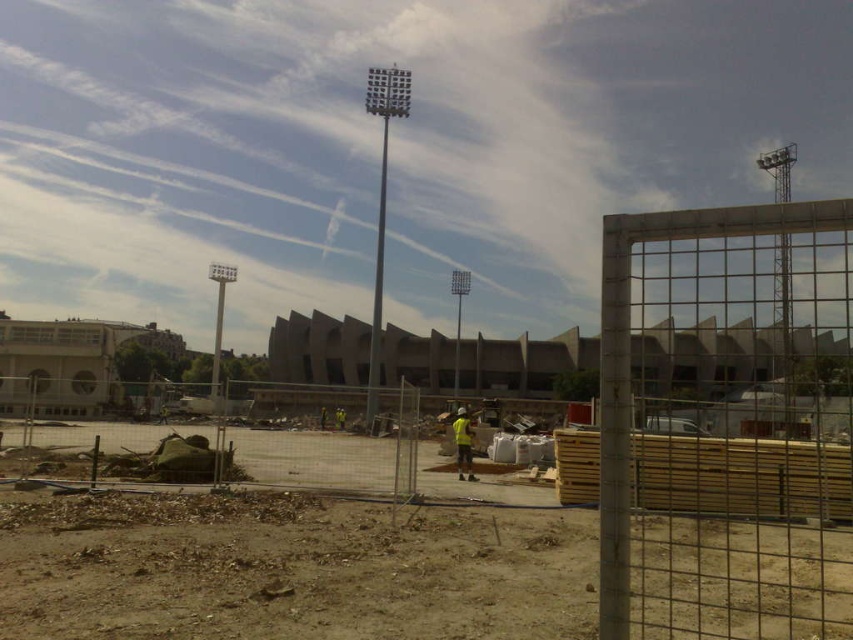
From the picture: Does metal mesh fence at center come in front of yellow reflective vest at center?

That is True.

Which is below, metal mesh fence at center or yellow reflective vest at center?

yellow reflective vest at center is lower down.

The image size is (853, 640). I want to click on metal mesh fence at center, so click(x=728, y=426).